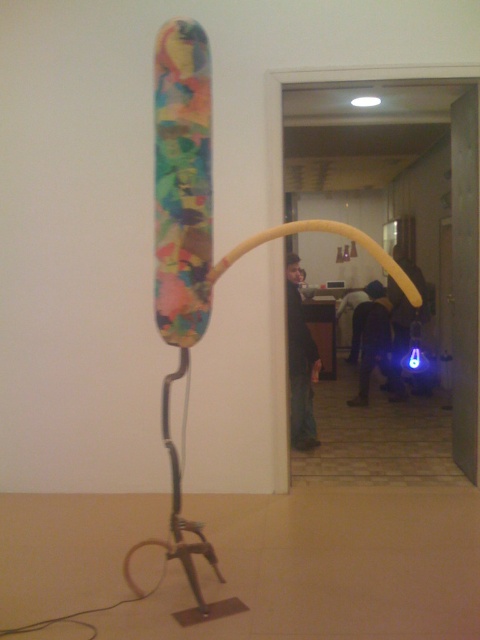
Question: Is the position of dark fabric jacket at center less distant than that of blue led light at center?

Choices:
 (A) no
 (B) yes

Answer: (B)

Question: Does dark blue jeans at center have a smaller size compared to blue led light at center?

Choices:
 (A) no
 (B) yes

Answer: (B)

Question: Which of the following is the farthest from the observer?

Choices:
 (A) blue led light at center
 (B) dark blue jeans at center
 (C) dark fabric jacket at center

Answer: (A)

Question: Is dark blue jeans at center bigger than dark fabric jacket at center?

Choices:
 (A) yes
 (B) no

Answer: (A)

Question: Which object is farther from the camera taking this photo?

Choices:
 (A) blue led light at center
 (B) dark fabric jacket at center

Answer: (A)

Question: Which point appears closest to the camera in this image?

Choices:
 (A) (315, 372)
 (B) (376, 296)
 (C) (421, 301)

Answer: (A)